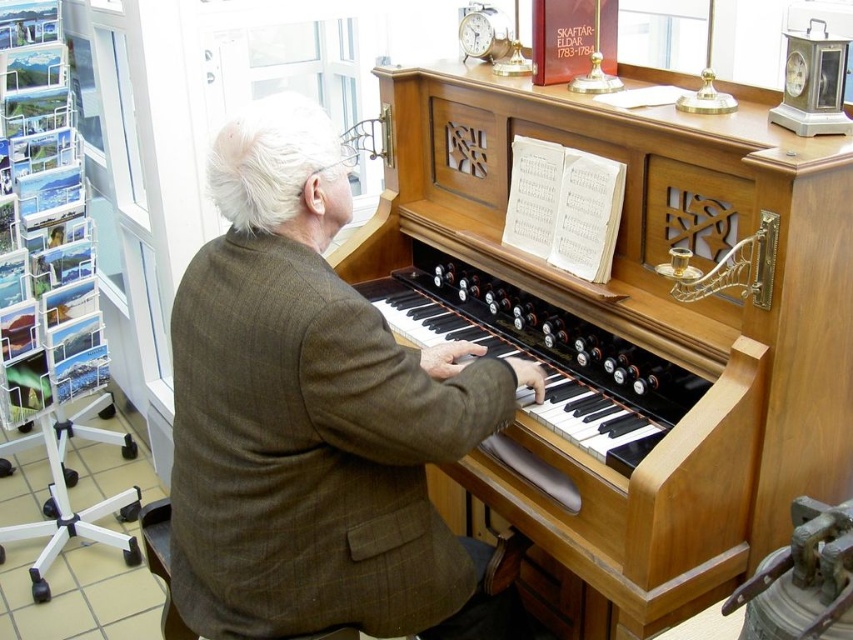
Who is more forward, (515, 252) or (276, 433)?

Point (276, 433)

Is point (651, 168) behind point (421, 419)?

That is True.

The height and width of the screenshot is (640, 853). I want to click on wooden piano at center, so click(x=646, y=326).